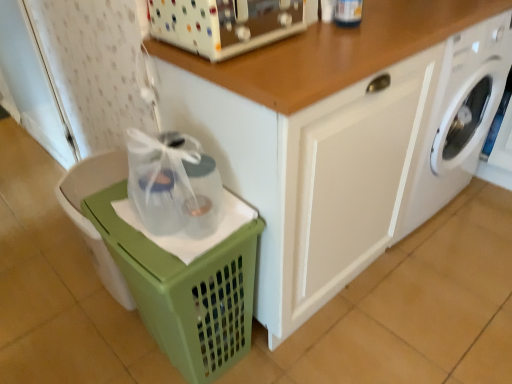
Image resolution: width=512 pixels, height=384 pixels. What are the coordinates of `free point to the right of white plastic toaster at upper center` in the screenshot? It's located at pos(334,41).